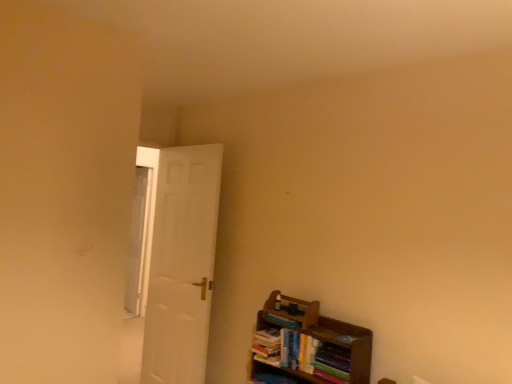
Question: Would you say clear glass window at left is to the left or to the right of hardcover books at lower right, acting as the 2th book starting from the top, in the picture?

Choices:
 (A) left
 (B) right

Answer: (A)

Question: Does point (129, 273) appear closer or farther from the camera than point (264, 334)?

Choices:
 (A) farther
 (B) closer

Answer: (A)

Question: Which is farther from the wooden bookshelf at lower right?

Choices:
 (A) clear glass window at left
 (B) hardcover book at lower right, acting as the 2th book starting from the bottom
 (C) hardcover books at lower right, acting as the 2th book starting from the top
 (D) white matte door at left

Answer: (A)

Question: Which object is positioned closest to the hardcover books at lower right, acting as the 2th book starting from the top?

Choices:
 (A) wooden bookshelf at lower right
 (B) white matte door at left
 (C) clear glass window at left
 (D) hardcover book at lower right, acting as the 2th book starting from the bottom

Answer: (D)